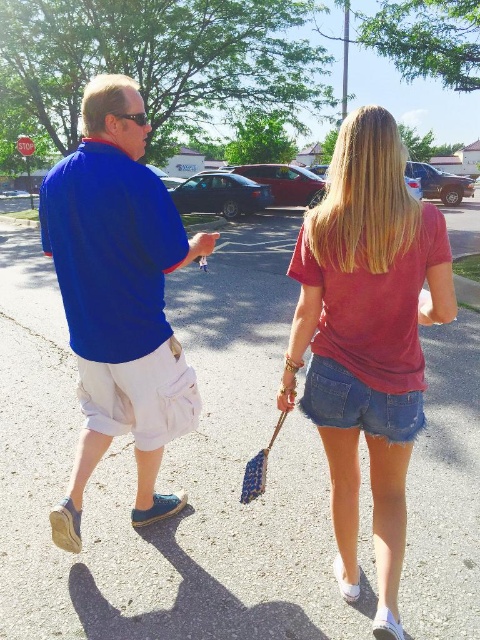
You are standing behind two people walking away from you on a street. You see a denim shorts at center and a blue cotton shirt at left. Which clothing item is positioned more to the right?

The denim shorts at center is positioned more to the right than the blue cotton shirt at left.

Looking at this image, you are a photographer trying to capture both the denim shorts at center and the blue cotton shirt at left in the same frame. Based on their heights, which one should you focus on to ensure both are visible in the photo?

The denim shorts at center is taller than the blue cotton shirt at left, so focusing on the denim shorts at center will ensure both are visible as it is the taller object.